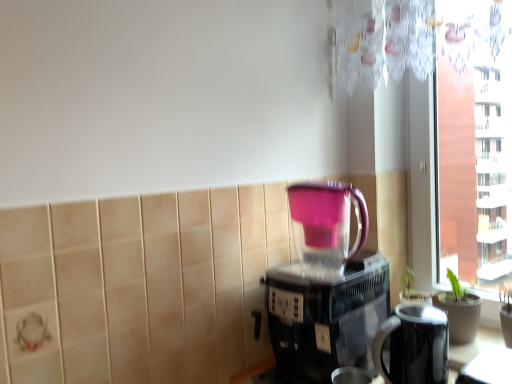
What do you see at coordinates (413, 345) in the screenshot?
I see `black glossy electric kettle at lower right` at bounding box center [413, 345].

In order to face black glossy electric kettle at lower right, should I rotate leftwards or rightwards?

Rotate right and turn 20.993 degrees.

The image size is (512, 384). What do you see at coordinates (327, 287) in the screenshot?
I see `black plastic coffee maker at center` at bounding box center [327, 287].

Find the location of a particular element. This screenshot has height=384, width=512. pink plastic blender at center is located at coordinates (326, 225).

Identify the location of transparent glass window at right. The image size is (512, 384). (472, 172).

This screenshot has width=512, height=384. Find the location of `black glossy electric kettle at lower right`. black glossy electric kettle at lower right is located at coordinates (413, 345).

Can you confirm if black plastic coffee maker at center is smaller than pink plastic blender at center?

No, black plastic coffee maker at center is not smaller than pink plastic blender at center.

From the image's perspective, is black plastic coffee maker at center on top of pink plastic blender at center?

No, from the image's perspective, black plastic coffee maker at center is not on top of pink plastic blender at center.

Is black plastic coffee maker at center aimed at pink plastic blender at center?

No, black plastic coffee maker at center does not turn towards pink plastic blender at center.

Does point (349, 319) come in front of point (320, 220)?

Yes, it is.

From the image's perspective, between black glossy electric kettle at lower right and pink plastic blender at center, which one is located above?

pink plastic blender at center is shown above in the image.

Based on their positions, is black glossy electric kettle at lower right located to the left or right of pink plastic blender at center?

From the image, it's evident that black glossy electric kettle at lower right is to the right of pink plastic blender at center.

Can you confirm if black glossy electric kettle at lower right is thinner than pink plastic blender at center?

No, black glossy electric kettle at lower right is not thinner than pink plastic blender at center.

From a real-world perspective, between black glossy electric kettle at lower right and pink plastic blender at center, who is vertically lower?

From a 3D spatial view, black glossy electric kettle at lower right is below.

Is black plastic coffee maker at center wider or thinner than black glossy electric kettle at lower right?

black plastic coffee maker at center is wider than black glossy electric kettle at lower right.

Is black plastic coffee maker at center inside the boundaries of black glossy electric kettle at lower right, or outside?

black plastic coffee maker at center exists outside the volume of black glossy electric kettle at lower right.

Are black plastic coffee maker at center and black glossy electric kettle at lower right beside each other?

No, black plastic coffee maker at center is not next to black glossy electric kettle at lower right.

What's the angular difference between black plastic coffee maker at center and black glossy electric kettle at lower right's facing directions?

black plastic coffee maker at center and black glossy electric kettle at lower right are facing 1.53 degrees away from each other.

Is there a large distance between transparent glass window at right and pink plastic blender at center?

No, transparent glass window at right is not far from pink plastic blender at center.

Which of these two, transparent glass window at right or pink plastic blender at center, stands shorter?

With less height is pink plastic blender at center.

Is the position of transparent glass window at right more distant than that of pink plastic blender at center?

Yes, it is behind pink plastic blender at center.

Who is smaller, black glossy electric kettle at lower right or black plastic coffee maker at center?

Smaller between the two is black glossy electric kettle at lower right.

Is black glossy electric kettle at lower right far away from black plastic coffee maker at center?

That's not correct — black glossy electric kettle at lower right is a little close to black plastic coffee maker at center.

This screenshot has height=384, width=512. Identify the location of appliance on the right of the black plastic coffee maker at center. (413, 345).

Between black plastic coffee maker at center and transparent glass window at right, which one has larger size?

With larger size is black plastic coffee maker at center.

Are black plastic coffee maker at center and transparent glass window at right located far from each other?

No, black plastic coffee maker at center is in close proximity to transparent glass window at right.

Can you tell me how much black plastic coffee maker at center and transparent glass window at right differ in facing direction?

The angle between the facing direction of black plastic coffee maker at center and the facing direction of transparent glass window at right is 1.55 degrees.

From the image's perspective, is black plastic coffee maker at center beneath transparent glass window at right?

Correct, black plastic coffee maker at center appears lower than transparent glass window at right in the image.

Which is behind, point (488, 263) or point (431, 329)?

The point (488, 263) is behind.

Between transparent glass window at right and black glossy electric kettle at lower right, which one has larger size?

Bigger between the two is transparent glass window at right.

The height and width of the screenshot is (384, 512). I want to click on coffee maker that appears on the right of pink plastic blender at center, so click(x=327, y=287).

This screenshot has height=384, width=512. Find the location of `appliance below the pink plastic blender at center (from the image's perspective)`. appliance below the pink plastic blender at center (from the image's perspective) is located at coordinates (413, 345).

When comparing their distances from black glossy electric kettle at lower right, does transparent glass window at right or black plastic coffee maker at center seem further?

transparent glass window at right lies further to black glossy electric kettle at lower right than the other object.

Looking at this image, which object lies nearer to the anchor point pink plastic blender at center, transparent glass window at right or black plastic coffee maker at center?

black plastic coffee maker at center lies closer to pink plastic blender at center than the other object.

When comparing their distances from pink plastic blender at center, does black glossy electric kettle at lower right or transparent glass window at right seem further?

The object further to pink plastic blender at center is transparent glass window at right.

Which object lies nearer to the anchor point transparent glass window at right, pink plastic blender at center or black glossy electric kettle at lower right?

black glossy electric kettle at lower right.

When comparing their distances from black plastic coffee maker at center, does transparent glass window at right or pink plastic blender at center seem further?

Among the two, transparent glass window at right is located further to black plastic coffee maker at center.

Looking at the image, which one is located closer to transparent glass window at right, black plastic coffee maker at center or black glossy electric kettle at lower right?

The object closer to transparent glass window at right is black glossy electric kettle at lower right.

Based on their spatial positions, is black glossy electric kettle at lower right or pink plastic blender at center closer to transparent glass window at right?

black glossy electric kettle at lower right lies closer to transparent glass window at right than the other object.

Estimate the real-world distances between objects in this image. Which object is further from black plastic coffee maker at center, black glossy electric kettle at lower right or transparent glass window at right?

transparent glass window at right lies further to black plastic coffee maker at center than the other object.

The height and width of the screenshot is (384, 512). Find the location of `blender between transparent glass window at right and black glossy electric kettle at lower right from top to bottom`. blender between transparent glass window at right and black glossy electric kettle at lower right from top to bottom is located at coordinates (326, 225).

The image size is (512, 384). Find the location of `coffee maker between transparent glass window at right and black glossy electric kettle at lower right from top to bottom`. coffee maker between transparent glass window at right and black glossy electric kettle at lower right from top to bottom is located at coordinates (327, 287).

Locate an element on the screen. This screenshot has width=512, height=384. coffee maker that lies between pink plastic blender at center and black glossy electric kettle at lower right from top to bottom is located at coordinates (327, 287).

At what (x,y) coordinates should I click in order to perform the action: click on coffee maker situated between pink plastic blender at center and transparent glass window at right from left to right. Please return your answer as a coordinate pair (x, y). The width and height of the screenshot is (512, 384). Looking at the image, I should click on (327, 287).